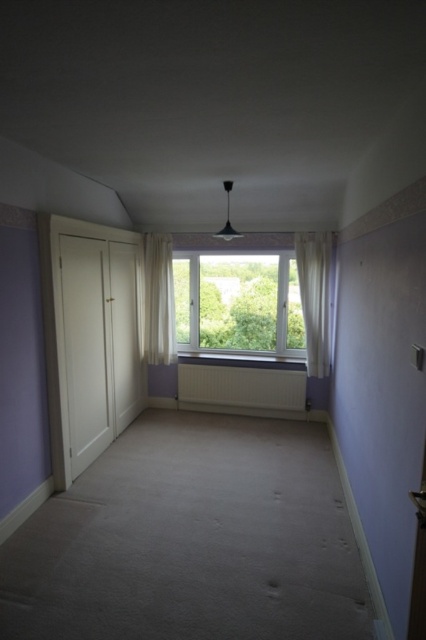
Is point (233, 269) farther from camera compared to point (302, 305)?

That is True.

Looking at this image, is white plastic window at center below white sheer curtain at right?

No, white plastic window at center is not below white sheer curtain at right.

This screenshot has height=640, width=426. In order to click on white plastic window at center in this screenshot , I will do `click(238, 301)`.

Identify the location of white plastic window at center. (238, 301).

Measure the distance between point (x=210, y=273) and camera.

The distance of point (x=210, y=273) from camera is 5.01 meters.

Is point (287, 282) closer to camera compared to point (304, 385)?

No, it is not.

The height and width of the screenshot is (640, 426). What are the coordinates of `white plastic window at center` in the screenshot? It's located at (238, 301).

Measure the distance between white plastic window at center and camera.

white plastic window at center and camera are 4.68 meters apart from each other.

Where is `white plastic window at center`? The image size is (426, 640). white plastic window at center is located at coordinates (238, 301).

Locate an element on the screen. The height and width of the screenshot is (640, 426). white plastic window at center is located at coordinates (238, 301).